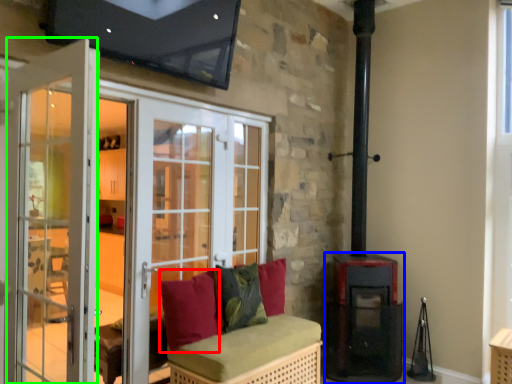
Question: Based on their relative distances, which object is nearer to pillow (highlighted by a red box)? Choose from stove (highlighted by a blue box) and screen door (highlighted by a green box).

Choices:
 (A) stove
 (B) screen door

Answer: (B)